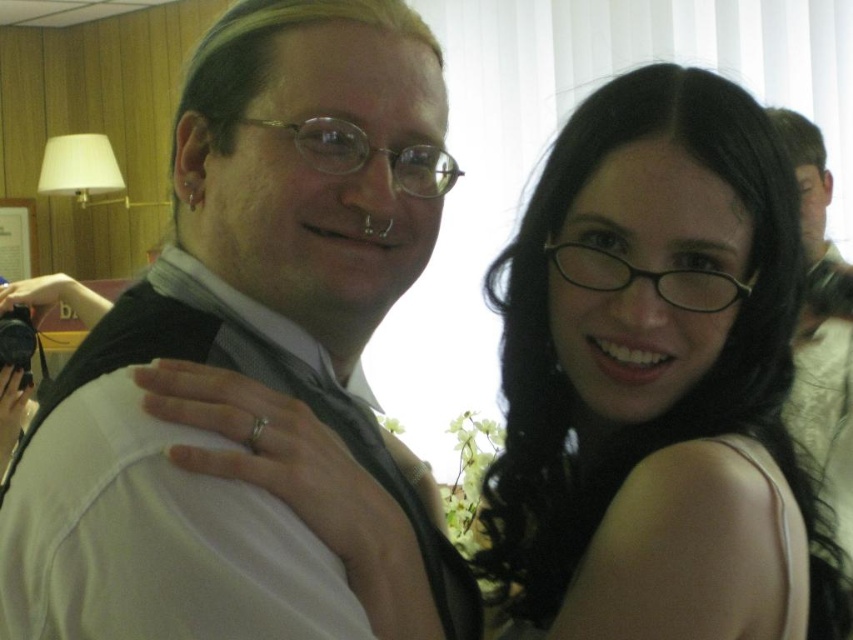
Who is more forward, (x=828, y=435) or (x=271, y=365)?

Positioned in front is point (x=271, y=365).

Does point (810, 403) lie behind point (415, 515)?

Yes.

Where is `matte black vest at upper left`? The width and height of the screenshot is (853, 640). matte black vest at upper left is located at coordinates (825, 408).

Does white matte vest at upper left appear on the left side of matte black vest at upper left?

Correct, you'll find white matte vest at upper left to the left of matte black vest at upper left.

Is white matte vest at upper left to the right of matte black vest at upper left from the viewer's perspective?

In fact, white matte vest at upper left is to the left of matte black vest at upper left.

Which is behind, point (251, 164) or point (805, 250)?

Point (805, 250)

Locate an element on the screen. The height and width of the screenshot is (640, 853). white matte vest at upper left is located at coordinates (244, 340).

Does white matte vest at upper left have a larger size compared to black glossy hair at upper center?

Indeed, white matte vest at upper left has a larger size compared to black glossy hair at upper center.

Is white matte vest at upper left shorter than black glossy hair at upper center?

Incorrect, white matte vest at upper left's height does not fall short of black glossy hair at upper center's.

Is point (78, 531) farther from viewer compared to point (535, 490)?

That is False.

The width and height of the screenshot is (853, 640). What are the coordinates of `white matte vest at upper left` in the screenshot? It's located at (244, 340).